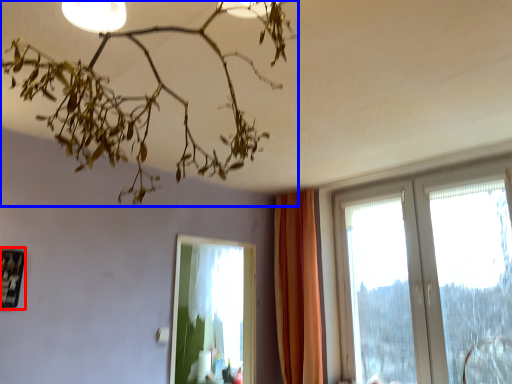
Question: Which point is further to the camera, picture frame (highlighted by a red box) or lamp (highlighted by a blue box)?

Choices:
 (A) picture frame
 (B) lamp

Answer: (A)